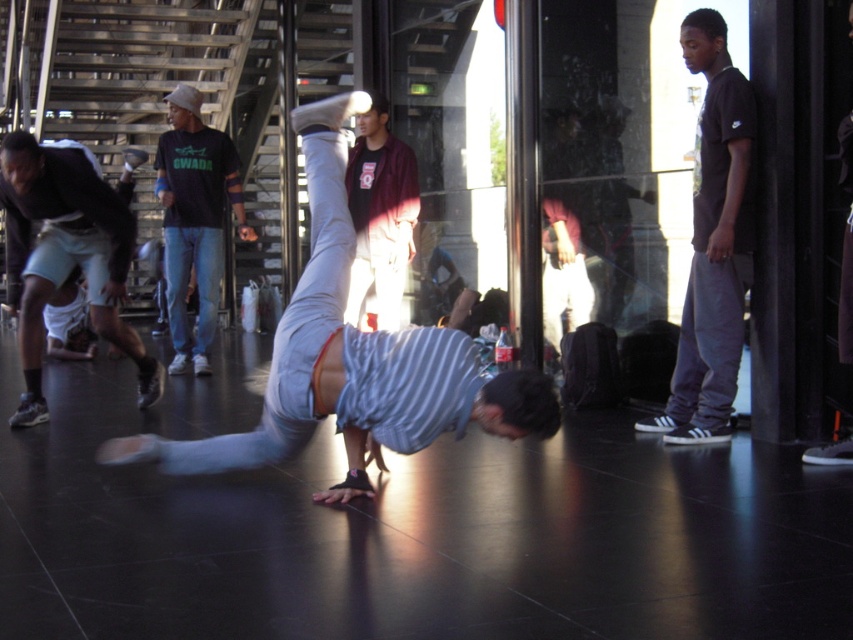
Based on the photo, you are a photographer trying to capture the central figure in the scene. Given that the striped cotton shirt at center and the dark gray pants at right are part of the subject, which clothing item will appear bigger in your photo?

The striped cotton shirt at center will appear bigger in the photo because it has a larger size compared to the dark gray pants at right.

In the image, there is a central figure performing a handstand wearing striped shirt and light colored pants. The maroon fabric pants at center is located at point (380, 214). Can you determine the coordinates of the maroon fabric pants at center?

The maroon fabric pants at center is located at point (380, 214).

You are a photographer trying to capture the central figure performing a handstand. You notice two people wearing maroon fabric pants at center and dark gray pants at right in the background. Which pair of pants will appear closer to the camera in your photo?

The maroon fabric pants at center will appear closer to the camera because the dark gray pants at right is behind it.